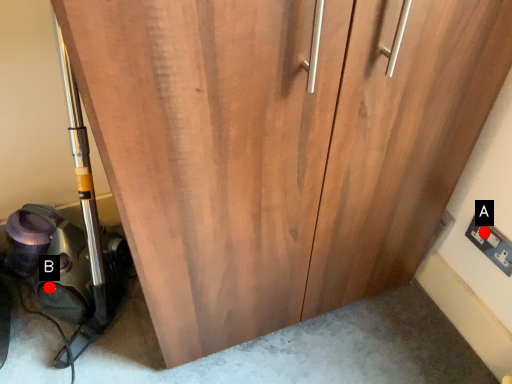
Question: Two points are circled on the image, labeled by A and B beside each circle. Among these points, which one is nearest to the camera?

Choices:
 (A) A is closer
 (B) B is closer

Answer: (A)